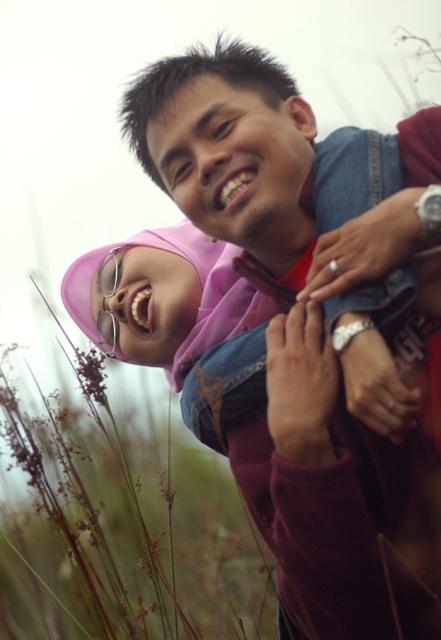
You are a photographer trying to capture a clear shot of both the denim jacket at upper center and the pink satin hijab at upper center in the image. Based on their sizes, which one might be easier to focus on and why?

The denim jacket at upper center has a larger size compared to the pink satin hijab at upper center, so it might be easier to focus on because larger objects generally provide more visual detail for the camera to lock onto.

You are a photographer trying to capture a clear photo of the pink satin hijab at upper center. However, the denim jacket at upper center is blocking your view. Can you adjust your position to take the photo without moving any objects?

The denim jacket at upper center is in front of the pink satin hijab at upper center, so you can move your camera position slightly to the side to avoid the denim jacket at upper center and capture the pink satin hijab at upper center clearly.